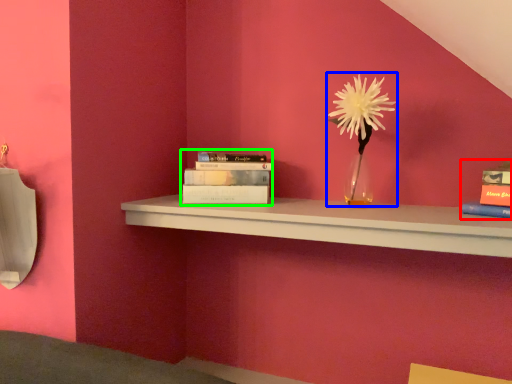
Question: Based on their relative distances, which object is nearer to book (highlighted by a red box)? Choose from floral arrangement (highlighted by a blue box) and book (highlighted by a green box).

Choices:
 (A) floral arrangement
 (B) book

Answer: (A)